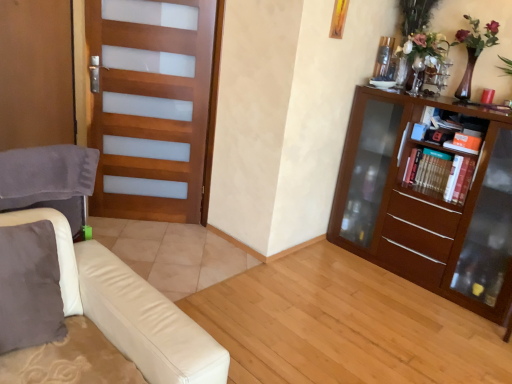
Question: From the image's perspective, would you say wooden screen door at left is shown under wooden bookshelf at right?

Choices:
 (A) yes
 (B) no

Answer: (B)

Question: Is wooden screen door at left positioned with its back to wooden bookshelf at right?

Choices:
 (A) yes
 (B) no

Answer: (B)

Question: Would you say wooden screen door at left is a long distance from wooden bookshelf at right?

Choices:
 (A) yes
 (B) no

Answer: (A)

Question: Is wooden screen door at left directly adjacent to wooden bookshelf at right?

Choices:
 (A) no
 (B) yes

Answer: (A)

Question: Considering the relative sizes of wooden screen door at left and wooden bookshelf at right in the image provided, is wooden screen door at left taller than wooden bookshelf at right?

Choices:
 (A) no
 (B) yes

Answer: (B)

Question: Is wooden bookshelf at right bigger or smaller than hardcover books at right?

Choices:
 (A) small
 (B) big

Answer: (B)

Question: Is wooden bookshelf at right taller or shorter than hardcover books at right?

Choices:
 (A) tall
 (B) short

Answer: (B)

Question: Is point (452, 195) positioned closer to the camera than point (455, 182)?

Choices:
 (A) closer
 (B) farther

Answer: (B)

Question: Is wooden bookshelf at right wider or thinner than hardcover books at right?

Choices:
 (A) thin
 (B) wide

Answer: (A)

Question: Which is correct: velvet gray swivel chair at left is inside wooden bookshelf at right, or outside of it?

Choices:
 (A) outside
 (B) inside

Answer: (A)

Question: Considering the positions of velvet gray swivel chair at left and wooden bookshelf at right in the image, is velvet gray swivel chair at left taller or shorter than wooden bookshelf at right?

Choices:
 (A) tall
 (B) short

Answer: (A)

Question: Based on their positions, is velvet gray swivel chair at left located to the left or right of wooden bookshelf at right?

Choices:
 (A) left
 (B) right

Answer: (A)

Question: Relative to wooden bookshelf at right, is velvet gray swivel chair at left in front or behind?

Choices:
 (A) behind
 (B) front

Answer: (B)

Question: Is point (454, 183) positioned closer to the camera than point (501, 140)?

Choices:
 (A) closer
 (B) farther

Answer: (B)

Question: Would you say hardcover books at right is inside or outside brown wooden bookcase at right?

Choices:
 (A) outside
 (B) inside

Answer: (B)